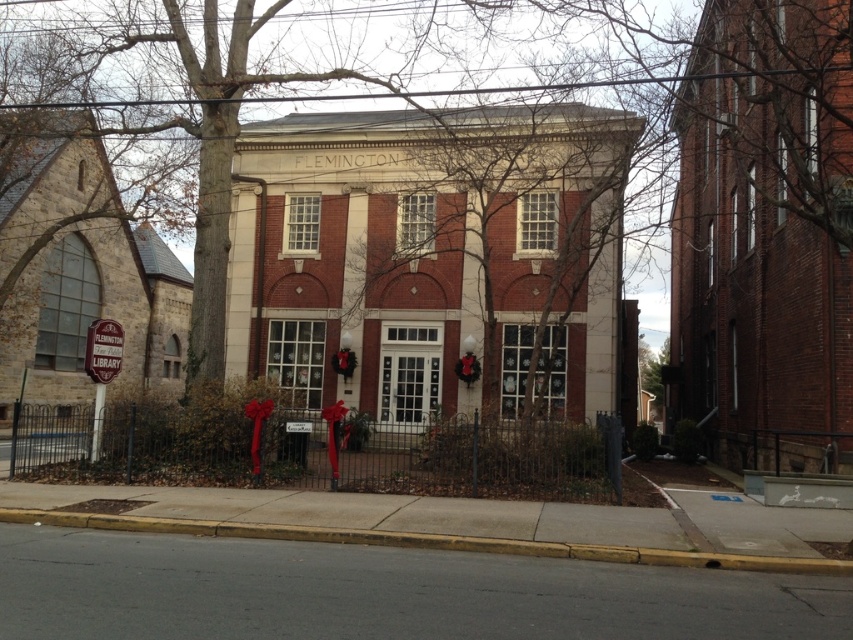
Which is more to the right, brick church at right or metallic wire fence at center?

brick church at right is more to the right.

How much distance is there between brick church at right and metallic wire fence at center?

brick church at right is 25.82 feet from metallic wire fence at center.

In order to click on brick church at right in this screenshot , I will do `click(764, 237)`.

Which is in front, point (149, 442) or point (57, 305)?

Positioned in front is point (149, 442).

Is point (543, 435) farther from viewer compared to point (74, 269)?

That is False.

Locate an element on the screen. The width and height of the screenshot is (853, 640). metallic wire fence at center is located at coordinates (321, 452).

Does point (395, 374) come closer to viewer compared to point (107, 298)?

Yes, it is.

Does brick building at center have a smaller size compared to stone church at left?

Yes.

Between point (328, 253) and point (111, 188), which one is positioned behind?

The point (111, 188) is behind.

Identify the location of brick building at center. This screenshot has height=640, width=853. (434, 257).